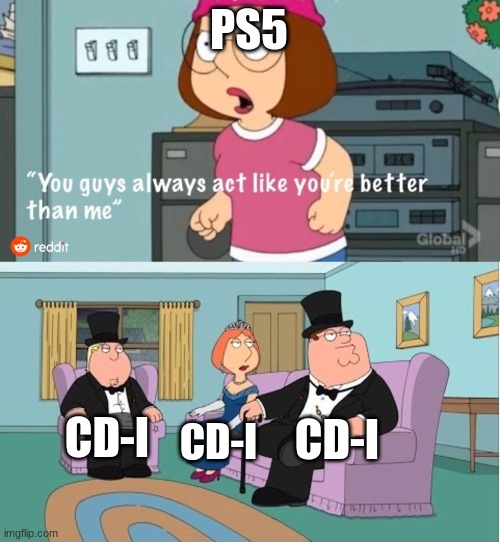
Find the location of `painting`. painting is located at coordinates click(x=409, y=327), click(x=491, y=315).